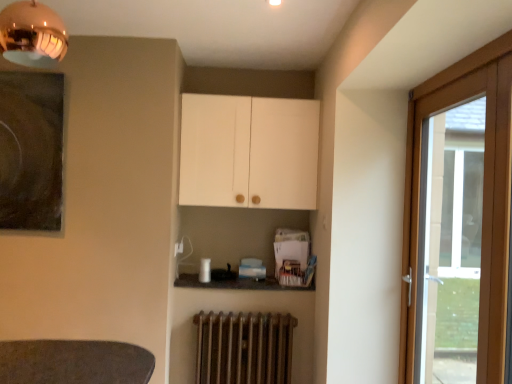
Question: Could you tell me if rusty metal radiator at lower center is turned towards wooden door at right?

Choices:
 (A) yes
 (B) no

Answer: (B)

Question: Considering the relative positions of rusty metal radiator at lower center and wooden door at right in the image provided, is rusty metal radiator at lower center to the right of wooden door at right from the viewer's perspective?

Choices:
 (A) yes
 (B) no

Answer: (B)

Question: From the image's perspective, is rusty metal radiator at lower center over wooden door at right?

Choices:
 (A) yes
 (B) no

Answer: (B)

Question: Can wooden door at right be found inside rusty metal radiator at lower center?

Choices:
 (A) yes
 (B) no

Answer: (B)

Question: Can you confirm if rusty metal radiator at lower center is positioned to the left of wooden door at right?

Choices:
 (A) no
 (B) yes

Answer: (B)

Question: Does rusty metal radiator at lower center have a greater height compared to wooden door at right?

Choices:
 (A) yes
 (B) no

Answer: (B)

Question: Is white matte cabinet at upper center positioned with its back to rusty metal radiator at lower center?

Choices:
 (A) no
 (B) yes

Answer: (A)

Question: Does white matte cabinet at upper center have a lesser height compared to rusty metal radiator at lower center?

Choices:
 (A) yes
 (B) no

Answer: (B)

Question: From the image's perspective, is white matte cabinet at upper center beneath rusty metal radiator at lower center?

Choices:
 (A) no
 (B) yes

Answer: (A)

Question: Could you tell me if white matte cabinet at upper center is turned towards rusty metal radiator at lower center?

Choices:
 (A) no
 (B) yes

Answer: (A)

Question: From a real-world perspective, is white matte cabinet at upper center on top of rusty metal radiator at lower center?

Choices:
 (A) yes
 (B) no

Answer: (A)

Question: Is the depth of white matte cabinet at upper center greater than that of rusty metal radiator at lower center?

Choices:
 (A) no
 (B) yes

Answer: (B)

Question: Can you confirm if wooden door at right is wider than granite countertop at center?

Choices:
 (A) yes
 (B) no

Answer: (B)